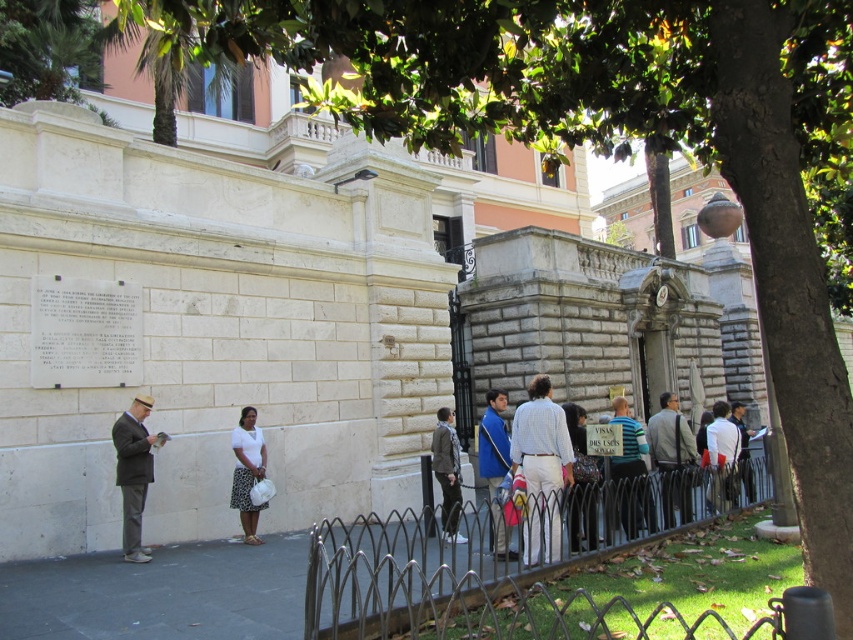
Question: Which object appears farthest from the camera in this image?

Choices:
 (A) metallic wire fence at center
 (B) gray wool coat at center
 (C) light blue striped shirt at center

Answer: (B)

Question: Which object appears closest to the camera in this image?

Choices:
 (A) blue fabric jacket at center
 (B) white cotton shirt at center
 (C) white matte skirt at center
 (D) light blue striped shirt at center

Answer: (A)

Question: Which object appears closest to the camera in this image?

Choices:
 (A) white cotton shirt at center
 (B) dark gray suit at left

Answer: (A)

Question: Can you confirm if light blue striped shirt at center is smaller than white matte skirt at center?

Choices:
 (A) yes
 (B) no

Answer: (A)

Question: Observing the image, what is the correct spatial positioning of light blue striped shirt at center in reference to blue fabric jacket at center?

Choices:
 (A) right
 (B) left

Answer: (A)

Question: Is dark gray suit at left positioned in front of gray wool coat at center?

Choices:
 (A) yes
 (B) no

Answer: (A)